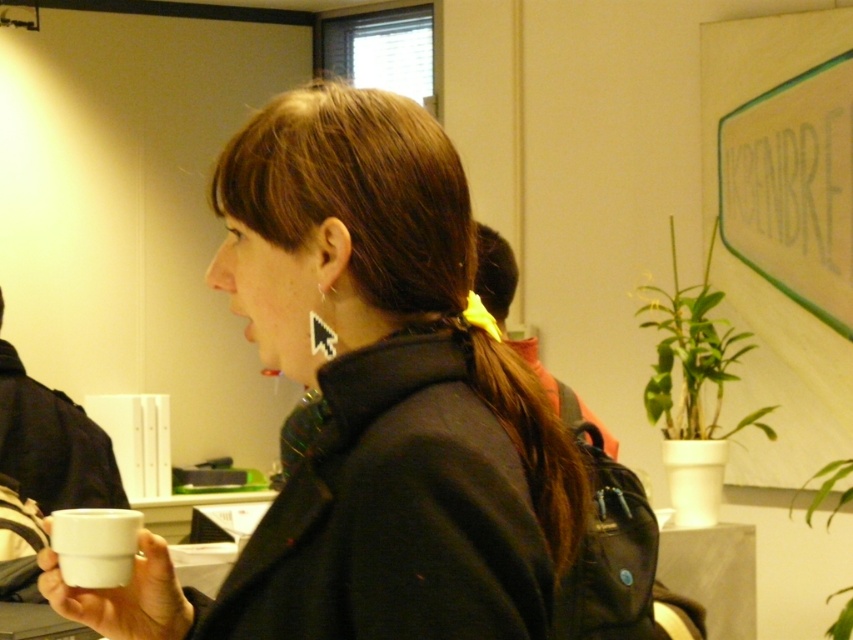
Who is more forward, (329, 632) or (54, 515)?

Point (329, 632) is more forward.

Does point (473, 637) come farther from viewer compared to point (79, 563)?

No.

Locate an element on the screen. The width and height of the screenshot is (853, 640). white matte cup at center is located at coordinates (370, 401).